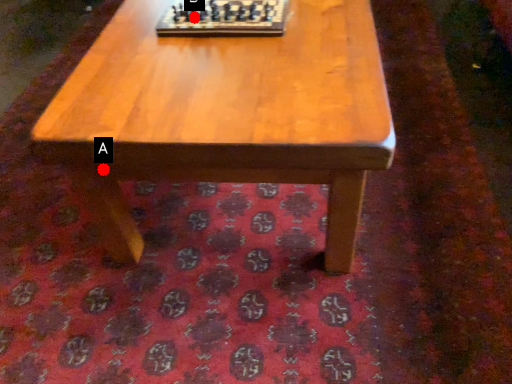
Question: Two points are circled on the image, labeled by A and B beside each circle. Which point is farther from the camera taking this photo?

Choices:
 (A) A is further
 (B) B is further

Answer: (B)